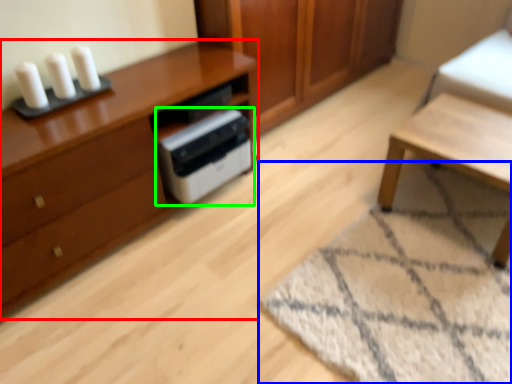
Question: Which object is positioned farthest from chest of drawers (highlighted by a red box)? Select from mat (highlighted by a blue box) and home appliance (highlighted by a green box).

Choices:
 (A) mat
 (B) home appliance

Answer: (A)